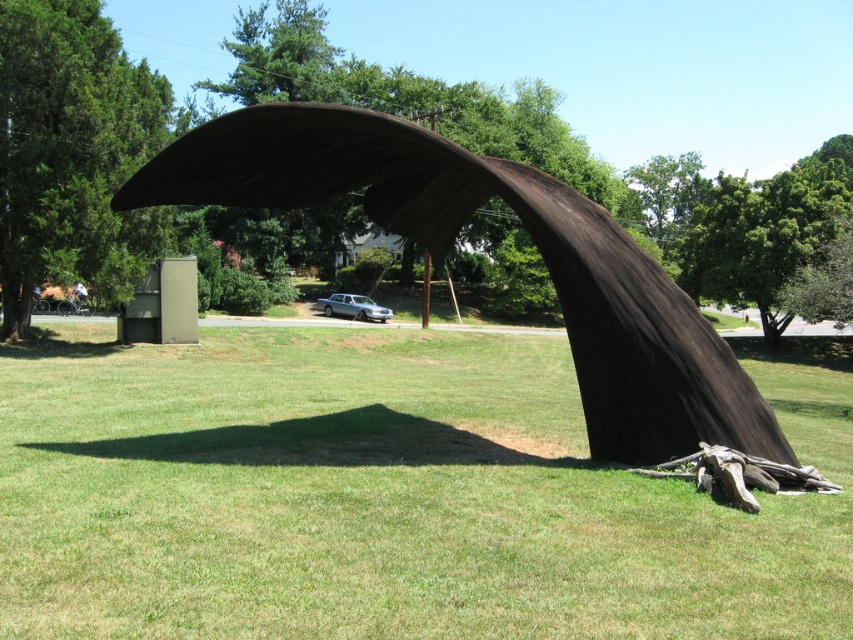
Who is taller, black wood sculpture at center or green leafy tree at left?

With more height is green leafy tree at left.

You are a GUI agent. You are given a task and a screenshot of the screen. Output one action in this format:
    pyautogui.click(x=<x>, y=<y>)
    Task: Click on the black wood sculpture at center
    The width and height of the screenshot is (853, 640).
    Given the screenshot: What is the action you would take?
    pyautogui.click(x=538, y=252)

Is point (627, 252) closer to camera compared to point (74, 150)?

Yes, point (627, 252) is in front of point (74, 150).

The height and width of the screenshot is (640, 853). I want to click on black wood sculpture at center, so click(x=538, y=252).

Does green grass at center appear on the right side of green leafy tree at left?

Correct, you'll find green grass at center to the right of green leafy tree at left.

Is green grass at center taller than green leafy tree at left?

No.

Image resolution: width=853 pixels, height=640 pixels. I want to click on green grass at center, so (x=384, y=497).

Where is `green grass at center`? The image size is (853, 640). green grass at center is located at coordinates (384, 497).

Is green grass at center to the left of black wood sculpture at center from the viewer's perspective?

No, green grass at center is not to the left of black wood sculpture at center.

Does green grass at center appear on the right side of black wood sculpture at center?

Correct, you'll find green grass at center to the right of black wood sculpture at center.

Is point (212, 506) positioned behind point (561, 304)?

No, it is in front of (561, 304).

Locate an element on the screen. The image size is (853, 640). green grass at center is located at coordinates (384, 497).